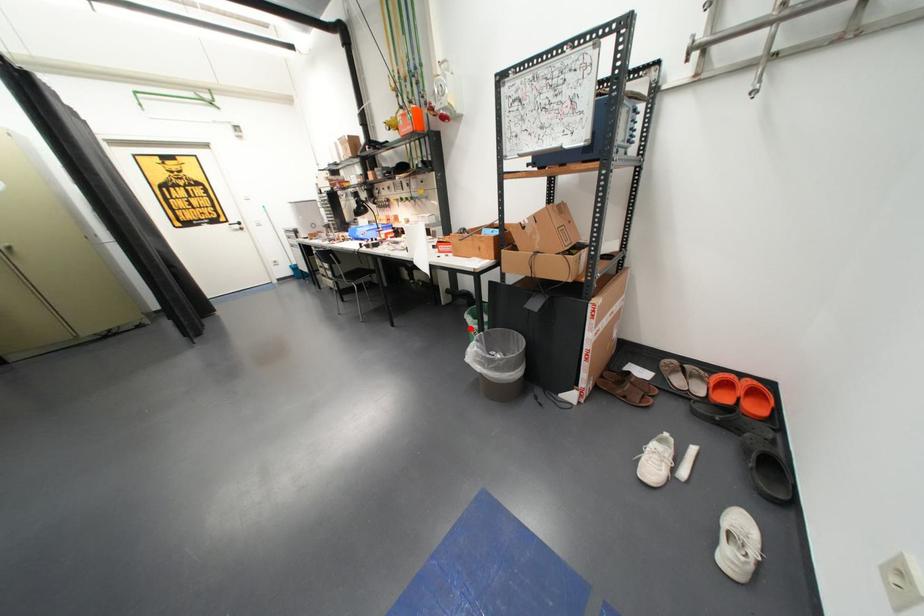
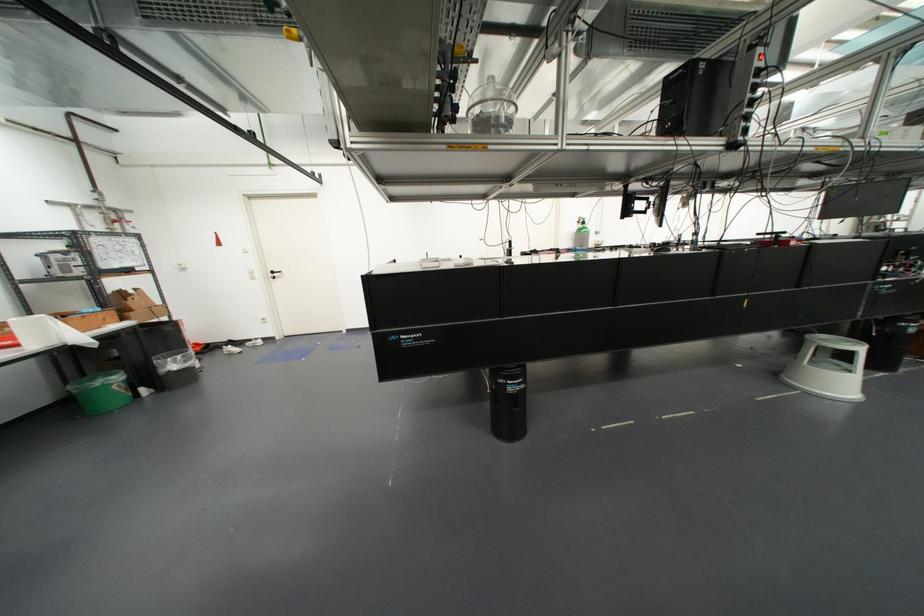
Where in the second image is the point corresponding to the highlighted location from the first image?

(113, 387)